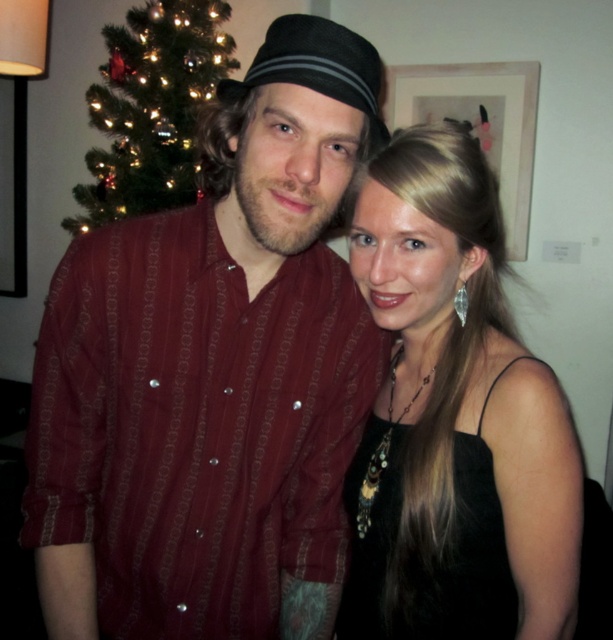
Please describe the color and texture of the clothing item located at the coordinates point (213, 374) in the image.

The clothing item at point (213, 374) is a matte red shirt at center.

You are a photographer trying to capture a photo of the matte red shirt at center and the green glittering christmas tree at upper left. Which object is positioned lower in the frame?

The matte red shirt at center is positioned below the green glittering christmas tree at upper left, so it is lower in the frame.

You are planning to hang a picture frame between the matte red shirt at center and the black satin dress at center. The frame requires at least 1 meter of space. Can the space between them accommodate it?

The matte red shirt at center might be wider than black satin dress at center, but the description does not provide specific measurements for the distance between them. Therefore, it is unclear if the space between them is at least 1 meter wide.